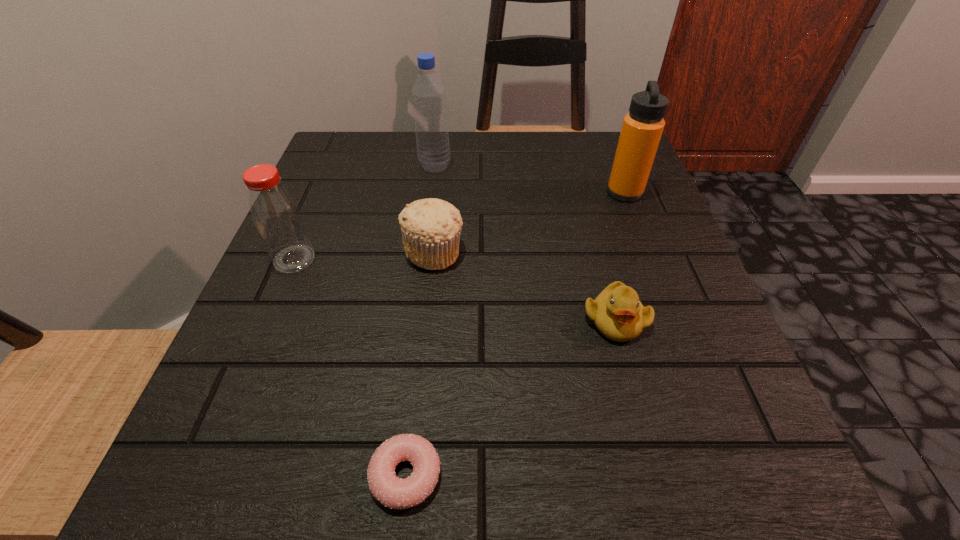
This screenshot has width=960, height=540. What are the coordinates of `the nearest object` in the screenshot? It's located at click(391, 491).

Where is `free space located 0.120m on the front of the right bottle`? The image size is (960, 540). free space located 0.120m on the front of the right bottle is located at coordinates (429, 210).

Identify the location of free spot located 0.250m on the left of the rightmost object. (485, 192).

Where is `free region located on the back of the shorter bottle`? This screenshot has height=540, width=960. free region located on the back of the shorter bottle is located at coordinates (325, 187).

The height and width of the screenshot is (540, 960). What are the coordinates of `vacant space situated 0.210m on the left of the fourth tallest object` in the screenshot? It's located at (284, 252).

Locate an element on the screen. vacant space situated on the front-facing side of the fifth farthest object is located at coordinates (667, 511).

Where is `vacant area located on the left of the nearest object`? This screenshot has width=960, height=540. vacant area located on the left of the nearest object is located at coordinates tap(318, 475).

Identify the location of bottle located in the far edge section of the desktop. (429, 98).

This screenshot has width=960, height=540. I want to click on thermos bottle present at the far edge, so click(642, 128).

Where is `object situated at the near edge`? Image resolution: width=960 pixels, height=540 pixels. object situated at the near edge is located at coordinates (391, 491).